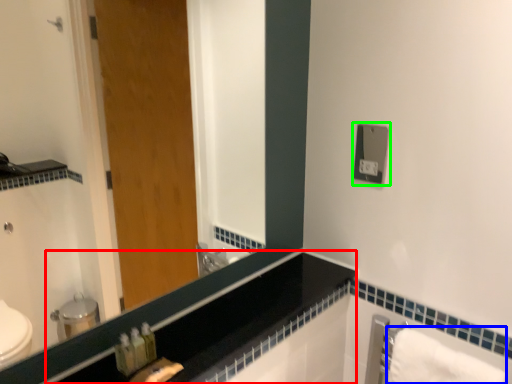
Question: Which object is the closest to the counter top (highlighted by a red box)? Choose among these: bath towel (highlighted by a blue box) or electric outlet (highlighted by a green box).

Choices:
 (A) bath towel
 (B) electric outlet

Answer: (A)